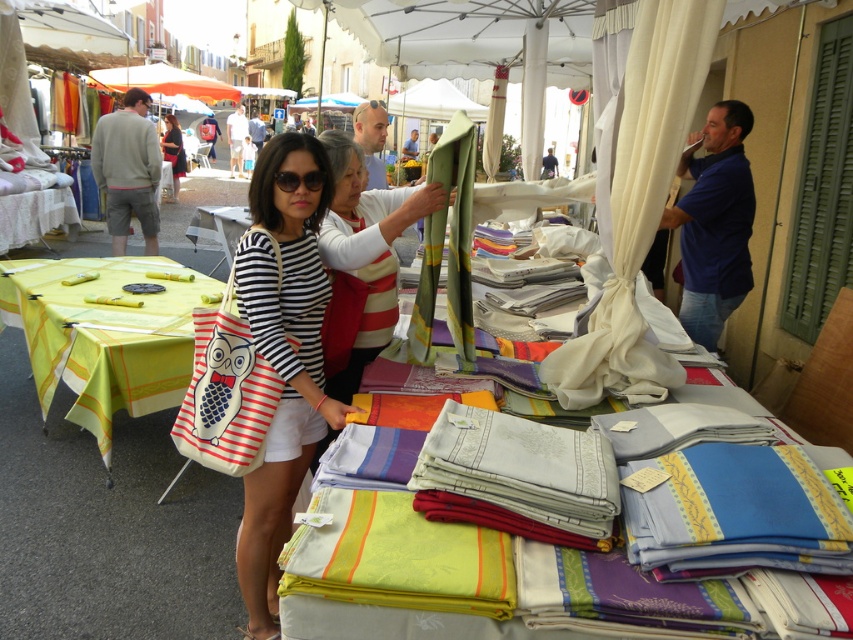
Question: Does striped cotton bag at center appear on the right side of green fabric at center?

Choices:
 (A) yes
 (B) no

Answer: (A)

Question: Which object appears farthest from the camera in this image?

Choices:
 (A) striped cotton bag at center
 (B) striped fabric bag at center
 (C) yellow fabric table at left

Answer: (B)

Question: Does yellow fabric table at left appear over gray cotton shorts at left?

Choices:
 (A) no
 (B) yes

Answer: (A)

Question: Which point is closer to the camera?

Choices:
 (A) yellow fabric table at center
 (B) yellow fabric table at left

Answer: (B)

Question: Can you confirm if yellow fabric table at left is positioned above green fabric at center?

Choices:
 (A) no
 (B) yes

Answer: (A)

Question: Estimate the real-world distances between objects in this image. Which object is closer to the blue cotton shirt at right?

Choices:
 (A) yellow fabric table at center
 (B) green fabric at center

Answer: (A)